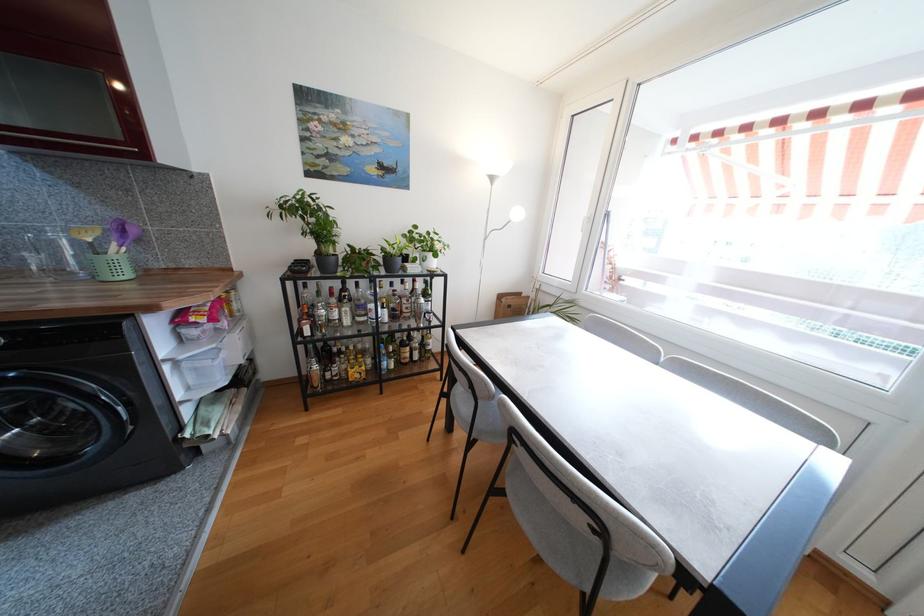
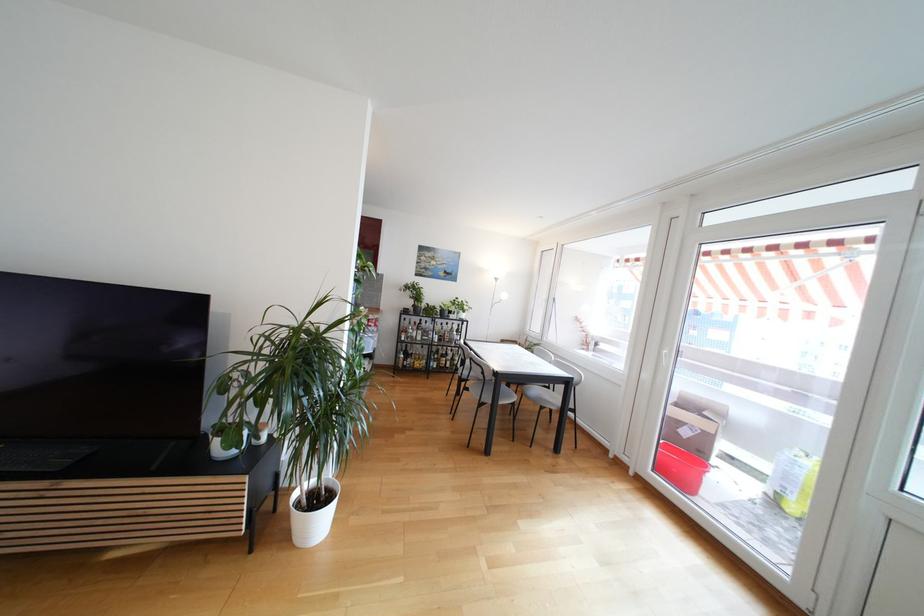
The point at (286, 282) is marked in the first image. Where is the corresponding point in the second image?

(405, 315)